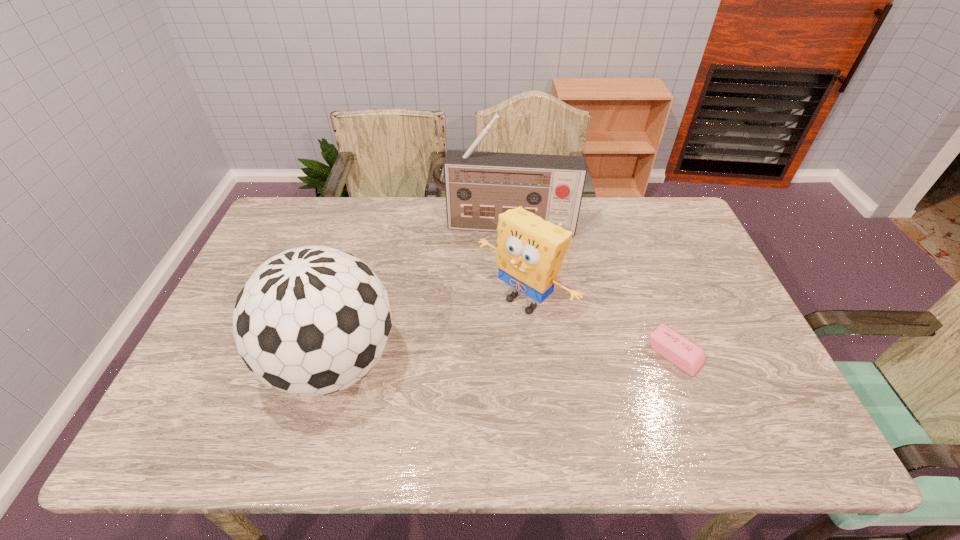
In the image, there is a desktop. Identify the location of blank space at the left edge. The image size is (960, 540). (234, 296).

In the image, there is a desktop. Where is `blank space at the near left corner`? blank space at the near left corner is located at coordinates (198, 401).

In the image, there is a desktop. Where is `free region at the far right corner`? This screenshot has height=540, width=960. free region at the far right corner is located at coordinates (690, 233).

At what (x,y) coordinates should I click in order to perform the action: click on unoccupied area between the second tallest object and the radio receiver. Please return your answer as a coordinate pair (x, y). Image resolution: width=960 pixels, height=540 pixels. Looking at the image, I should click on (420, 295).

What are the coordinates of `vacant space that's between the second shortest object and the soccer ball` in the screenshot? It's located at (429, 332).

Locate an element on the screen. The height and width of the screenshot is (540, 960). free space between the sponge and the rightmost object is located at coordinates (599, 328).

The height and width of the screenshot is (540, 960). I want to click on free area in between the radio receiver and the soccer ball, so [x=420, y=295].

The image size is (960, 540). I want to click on vacant region between the second shortest object and the leftmost object, so click(x=429, y=332).

Where is `unoccupied position between the third tallest object and the eraser`? This screenshot has height=540, width=960. unoccupied position between the third tallest object and the eraser is located at coordinates (599, 328).

In order to click on empty space between the sponge and the shortest object in this screenshot , I will do `click(599, 328)`.